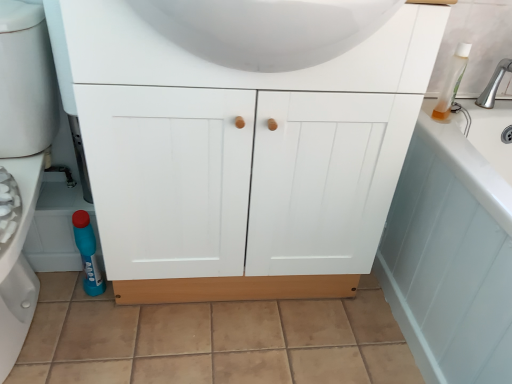
Question: From the image's perspective, is brushed metal faucet at upper right positioned above or below light blue wood bath at lower right?

Choices:
 (A) above
 (B) below

Answer: (A)

Question: From a real-world perspective, is brushed metal faucet at upper right positioned above or below light blue wood bath at lower right?

Choices:
 (A) below
 (B) above

Answer: (B)

Question: Which is nearer to the translucent plastic bottle at upper right?

Choices:
 (A) white matte cabinet at center
 (B) light blue wood bath at lower right
 (C) white glossy sink at upper center
 (D) blue glossy cleaner bottle at lower left
 (E) brushed metal faucet at upper right

Answer: (E)

Question: Based on their relative distances, which object is farther from the blue glossy cleaner bottle at lower left?

Choices:
 (A) blue plastic bottle at lower left
 (B) white matte cabinet at center
 (C) translucent plastic bottle at upper right
 (D) white glossy sink at upper center
 (E) brushed metal faucet at upper right

Answer: (E)